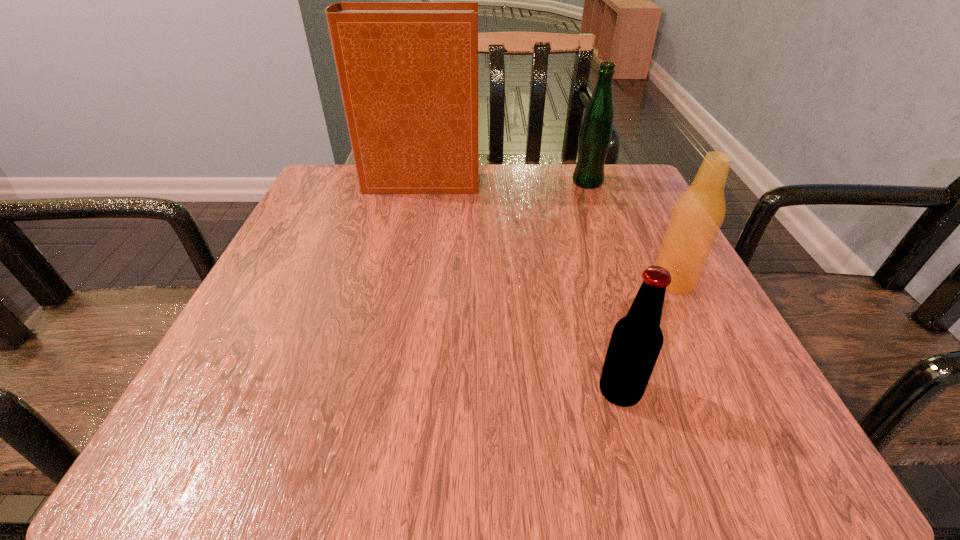
Where is `the tallest object`? The image size is (960, 540). the tallest object is located at coordinates (408, 71).

This screenshot has height=540, width=960. I want to click on hardback book, so click(408, 71).

Where is `the farthest beer bottle`? Image resolution: width=960 pixels, height=540 pixels. the farthest beer bottle is located at coordinates (595, 136).

Identify the location of the second nearest object. (696, 218).

At what (x,y) coordinates should I click in order to perform the action: click on the rightmost beer bottle. Please return your answer as a coordinate pair (x, y). Looking at the image, I should click on (696, 218).

Identify the location of the nearest object. The image size is (960, 540). (636, 341).

Identify the location of free space located 0.100m on the open cover of the tallest object. (523, 183).

You are a GUI agent. You are given a task and a screenshot of the screen. Output one action in this format:
    pyautogui.click(x=<x>, y=<y>)
    Task: Click on the vacant space situated on the front of the farthest beer bottle
    The width and height of the screenshot is (960, 540).
    Given the screenshot: What is the action you would take?
    pyautogui.click(x=597, y=207)

I want to click on vacant space positioned 0.110m on the front of the rightmost beer bottle, so [707, 349].

Locate an element on the screen. This screenshot has width=960, height=540. free space located on the back of the nearest object is located at coordinates (604, 335).